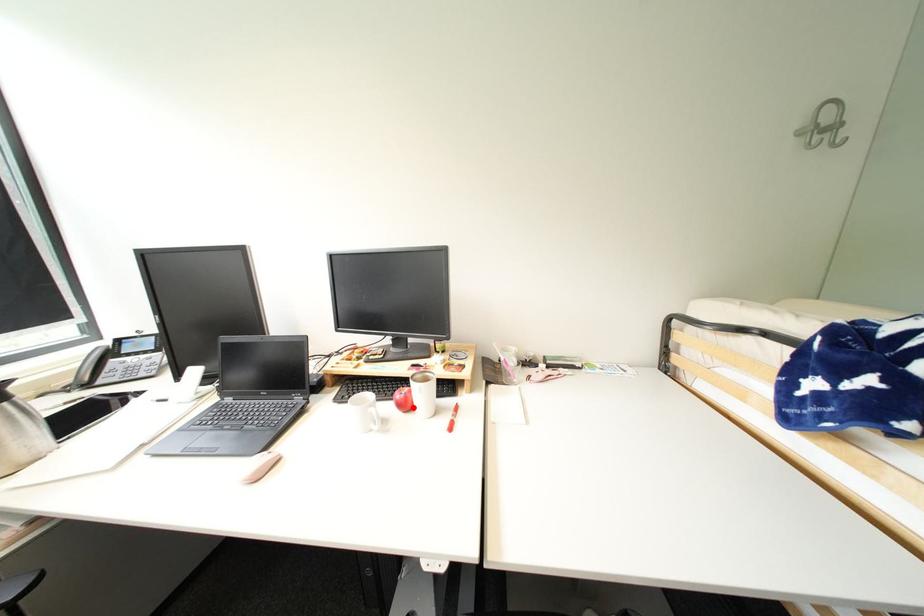
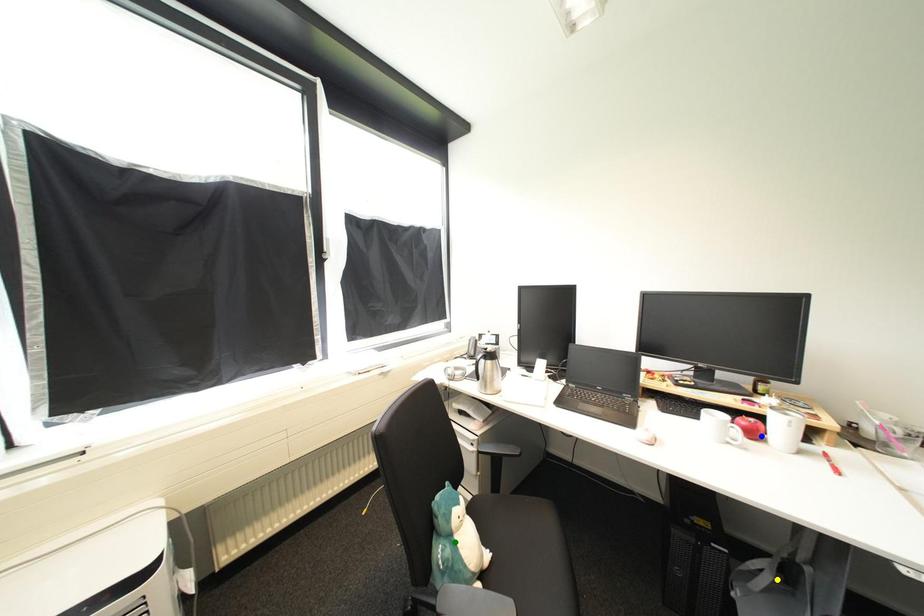
Question: I am providing you with two images of the same scene from different viewpoints. A red point is marked on the first image. You are given multiple points on the second image. Which spot in image 2 lines up with the point in image 1?

Choices:
 (A) blue point
 (B) green point
 (C) yellow point

Answer: (A)